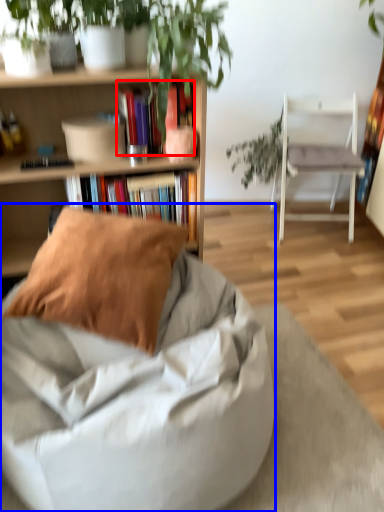
Question: Among these objects, which one is nearest to the camera, book (highlighted by a red box) or chair (highlighted by a blue box)?

Choices:
 (A) book
 (B) chair

Answer: (B)